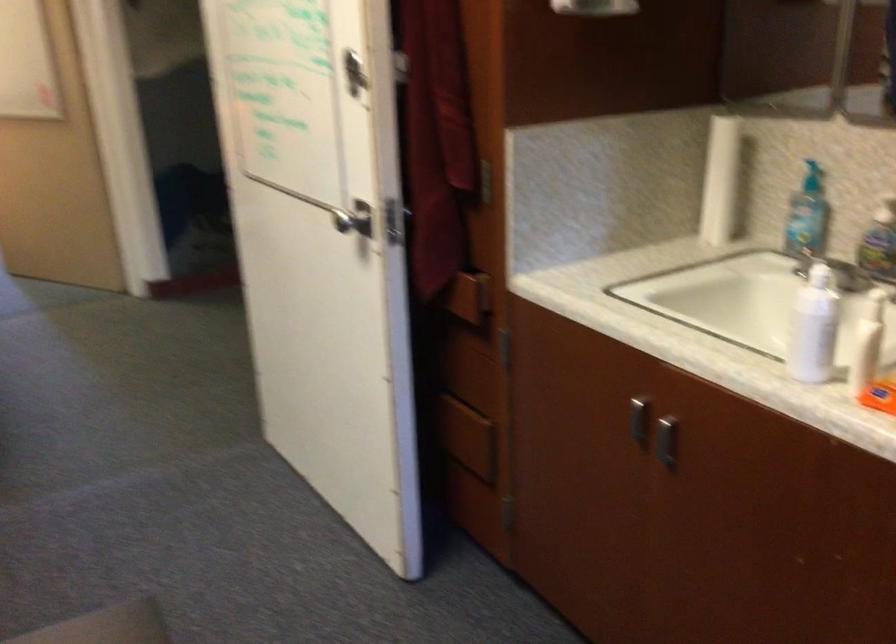
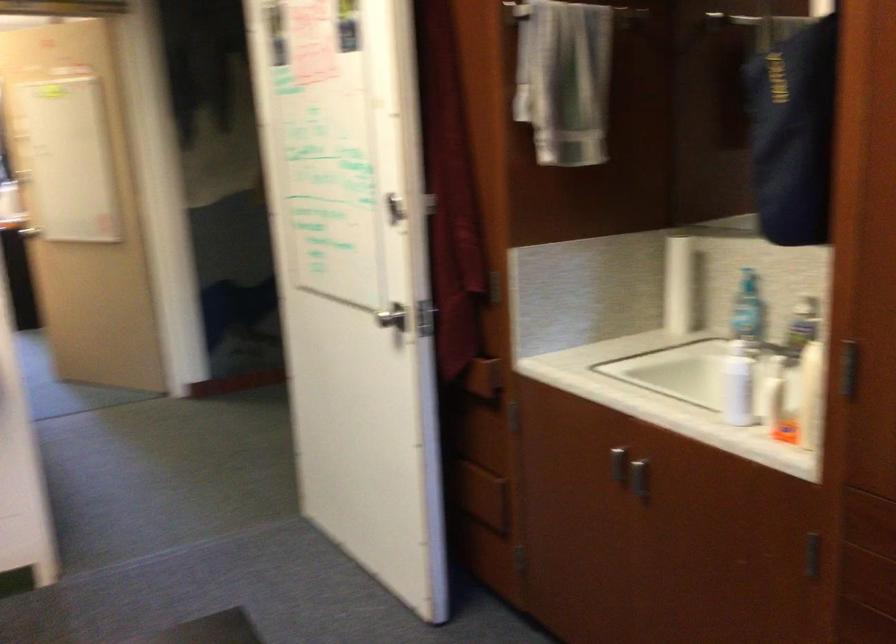
Locate, in the second image, the point that corresponds to the point at 807,178 in the first image.

(747, 279)